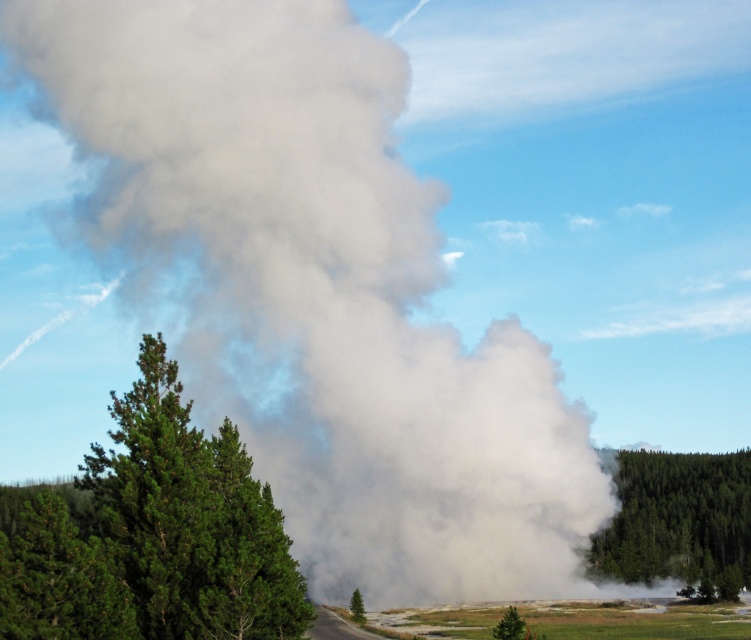
Question: Which object is farther from the camera taking this photo?

Choices:
 (A) white fluffy cloud at upper center
 (B) green textured tree at left
 (C) green matte tree at center

Answer: (A)

Question: Which of these objects is positioned farthest from the green matte tree at center?

Choices:
 (A) white fluffy cloud at upper center
 (B) green textured tree at lower right
 (C) green textured tree at left

Answer: (A)

Question: Can you confirm if white fluffy cloud at upper center is positioned below green matte tree at center?

Choices:
 (A) yes
 (B) no

Answer: (B)

Question: Considering the relative positions of green textured tree at lower right and green matte tree at center in the image provided, where is green textured tree at lower right located with respect to green matte tree at center?

Choices:
 (A) above
 (B) below

Answer: (A)

Question: Which point is closer to the camera?

Choices:
 (A) green matte tree at center
 (B) white fluffy cloud at upper center
 (C) green textured tree at lower right

Answer: (A)

Question: Does green textured tree at left come in front of white fluffy cloud at upper center?

Choices:
 (A) yes
 (B) no

Answer: (A)